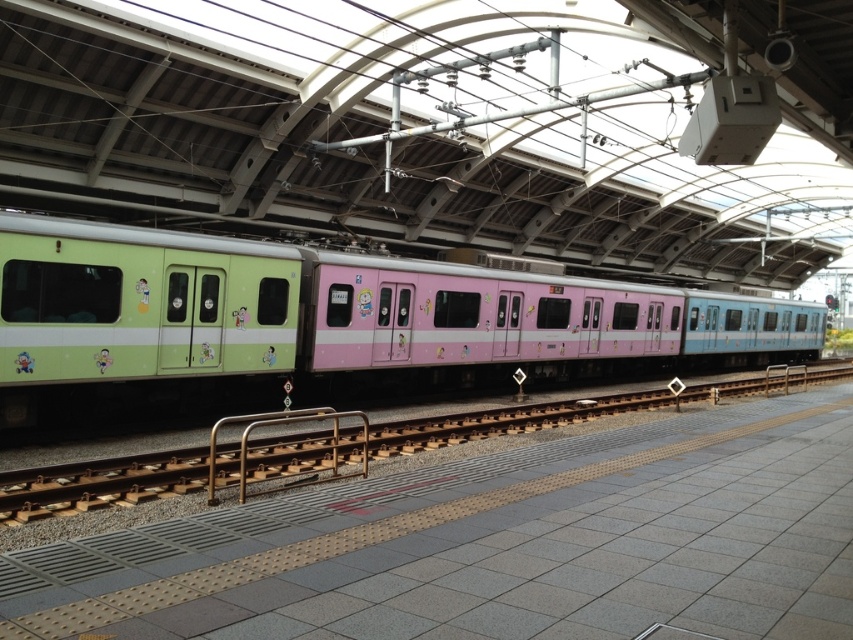
In the scene shown: You are a train conductor who needs to ensure the train fits within the platform area. Based on the scene, can you confirm if the pastel matte train at center will fit on the platform given its size compared to the green matte rail at left?

The pastel matte train at center is larger in size than the green matte rail at left. Since the platform is designed to accommodate the train, it should fit within the platform area as intended.

You are standing on the train station platform and want to take a photo of the train. You notice two points on the platform marked as point 1 and point 2. Point 1 is at coordinate (84, 310) and point 2 is at coordinate (281, 417). If you want to capture the train in your photo without any obstructions, which point should you stand closer to?

You should stand closer to point 1 at coordinate (84, 310) because it is closer to the camera, allowing for a clearer and less obstructed view of the train.

You are a passenger on the platform waiting for the train to arrive. You notice the pastel matte train at center and the brown metallic rail at center. Which object is closer to the edge of the platform?

The brown metallic rail at center is closer to the edge of the platform because the pastel matte train at center is positioned to the right of it, meaning the rail is between the train and the edge.